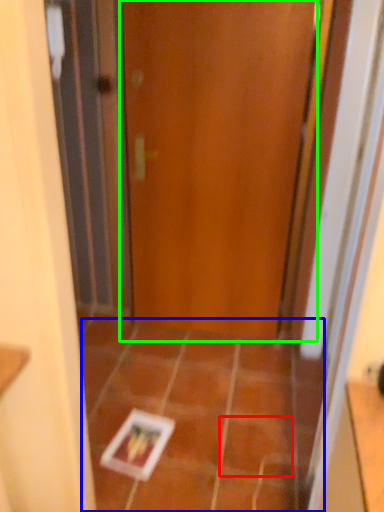
Question: Estimate the real-world distances between objects in this image. Which object is farther from ceramic tile (highlighted by a red box), ceramic tile (highlighted by a blue box) or door (highlighted by a green box)?

Choices:
 (A) ceramic tile
 (B) door

Answer: (B)